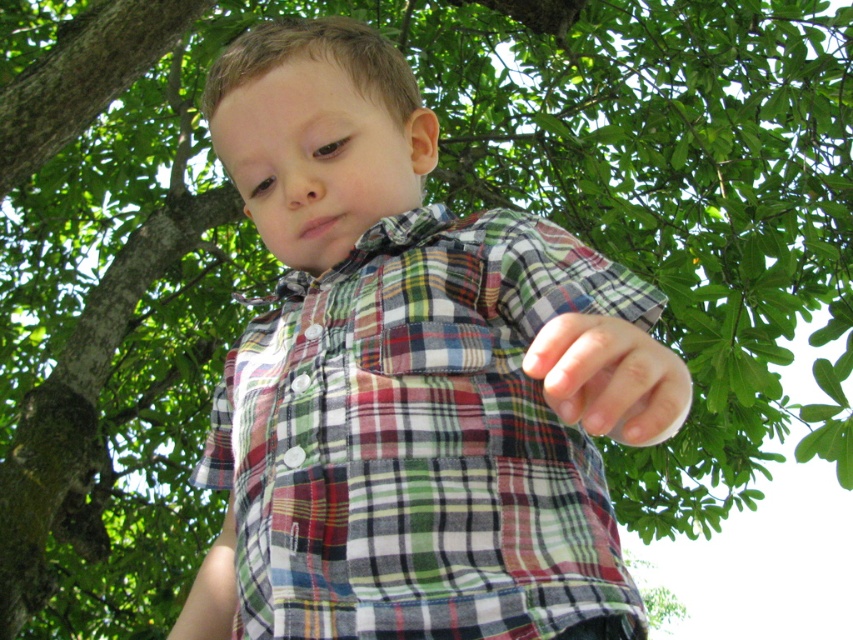
Can you confirm if plaid cotton shirt at center is smaller than green rough bark at upper left?

Actually, plaid cotton shirt at center might be larger than green rough bark at upper left.

Which is in front, point (410, 611) or point (50, 96)?

Positioned in front is point (410, 611).

This screenshot has height=640, width=853. What do you see at coordinates (410, 378) in the screenshot? I see `plaid cotton shirt at center` at bounding box center [410, 378].

Identify the location of plaid cotton shirt at center. (410, 378).

Who is higher up, plaid cotton shirt at center or matte plaid shirt at center?

matte plaid shirt at center is above.

Between point (315, 324) and point (619, 436), which one is positioned in front?

Point (619, 436)

Identify the location of plaid cotton shirt at center. [x=410, y=378].

Between green rough bark at upper left and matte plaid shirt at center, which one has more height?

With more height is green rough bark at upper left.

Is point (36, 118) more distant than point (548, 326)?

Yes, it is.

Where is `green rough bark at upper left`? green rough bark at upper left is located at coordinates (83, 76).